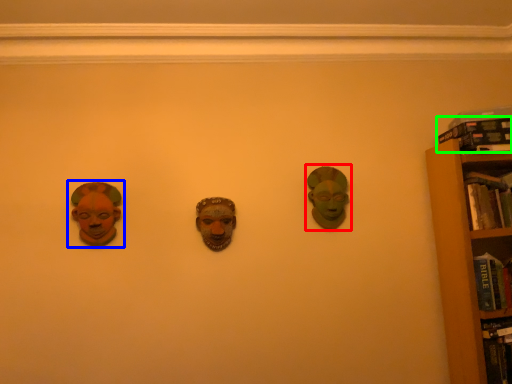
Question: Based on their relative distances, which object is nearer to head (highlighted by a red box)? Choose from head (highlighted by a blue box) and book (highlighted by a green box).

Choices:
 (A) head
 (B) book

Answer: (B)